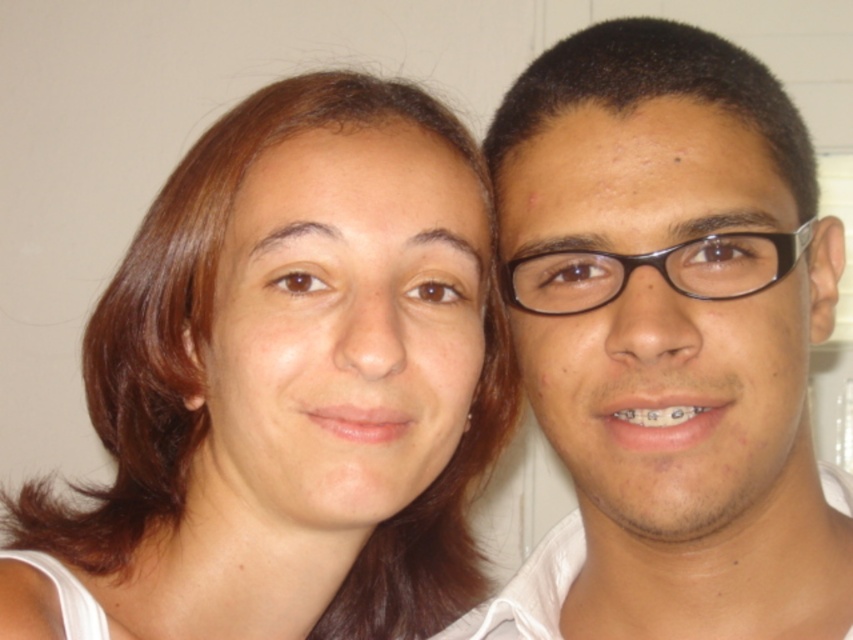
You are a photographer setting up for a portrait. You need to ensure that the brown hair at center and the matte black glasses at right are both visible in the frame. Based on their sizes, which object should you prioritize framing first to ensure it fits?

The brown hair at center is wider than the matte black glasses at right, so you should prioritize framing the brown hair at center first to ensure it fits in the frame.

You are a photographer trying to adjust the focus of your camera. You want to ensure that both the brown hair at center and the matte black glasses at right are clearly visible. Given their sizes, which object should you prioritize focusing on first?

The brown hair at center should be prioritized for focusing first because it has a larger size compared to the matte black glasses at right, making it more prominent in the image.